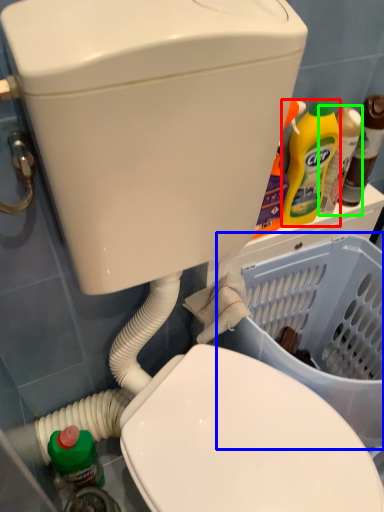
Question: Considering the real-world distances, which object is farthest from cleaning product (highlighted by a red box)? basket container (highlighted by a blue box) or bottle (highlighted by a green box)?

Choices:
 (A) basket container
 (B) bottle

Answer: (A)